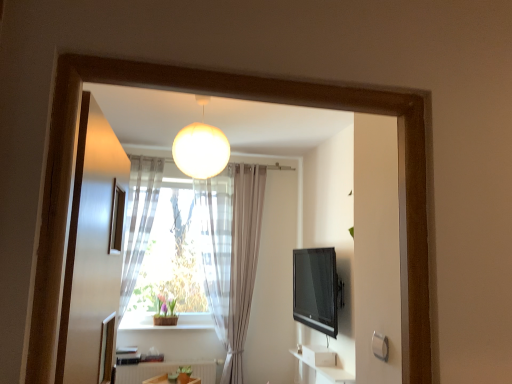
Question: From a real-world perspective, relative to matte glass globe at upper center, is black glossy tv at right vertically above or below?

Choices:
 (A) below
 (B) above

Answer: (A)

Question: From the image's perspective, is black glossy tv at right positioned above or below matte glass globe at upper center?

Choices:
 (A) below
 (B) above

Answer: (A)

Question: Estimate the real-world distances between objects in this image. Which object is closer to the matte glass globe at upper center?

Choices:
 (A) white matte radiator at lower center
 (B) black glossy tv at right
 (C) transparent glass screen door at center
 (D) translucent fabric curtain at center, which is counted as the first curtain, starting from the left
 (E) white sheer curtain at center, which is counted as the 2th curtain, starting from the left

Answer: (C)

Question: Which is farther from the matte glass globe at upper center?

Choices:
 (A) transparent glass screen door at center
 (B) translucent fabric curtain at center, which is counted as the first curtain, starting from the left
 (C) white matte radiator at lower center
 (D) white sheer curtain at center, which is counted as the 2th curtain, starting from the left
 (E) black glossy tv at right

Answer: (C)